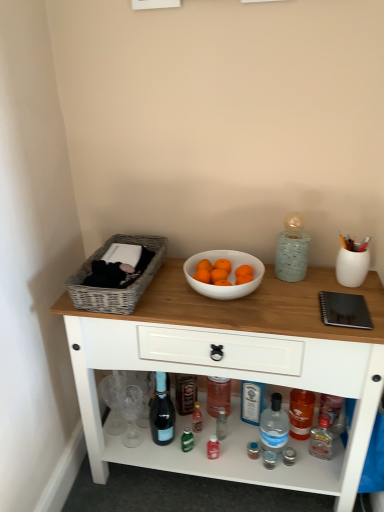
Where is `empty space that is ontop of wooden table at center (from a real-world perspective)`? This screenshot has width=384, height=512. empty space that is ontop of wooden table at center (from a real-world perspective) is located at coordinates (244, 296).